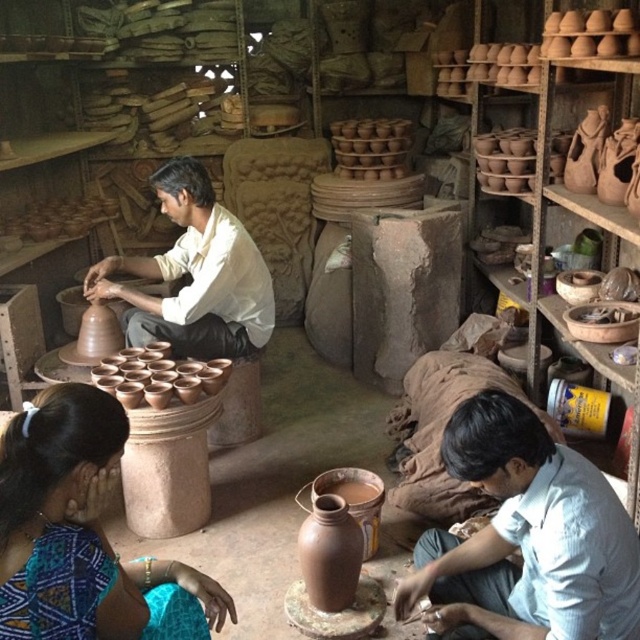
Which is below, blue printed fabric at lower left or matte clay vase at center?

Positioned lower is matte clay vase at center.

Can you confirm if blue printed fabric at lower left is shorter than matte clay vase at center?

No.

Which is in front, point (109, 576) or point (352, 595)?

Point (109, 576) is more forward.

Where is `blue printed fabric at lower left`? This screenshot has height=640, width=640. blue printed fabric at lower left is located at coordinates (76, 529).

Is light blue cotton shirt at lower right to the left of matte clay potter at center from the viewer's perspective?

No, light blue cotton shirt at lower right is not to the left of matte clay potter at center.

Is light blue cotton shirt at lower right smaller than matte clay potter at center?

Correct, light blue cotton shirt at lower right occupies less space than matte clay potter at center.

The width and height of the screenshot is (640, 640). What are the coordinates of `light blue cotton shirt at lower right` in the screenshot? It's located at (525, 538).

Between light blue cotton shirt at lower right and matte clay cups at center, which one has more height?

Standing taller between the two is light blue cotton shirt at lower right.

Describe the element at coordinates (525, 538) in the screenshot. I see `light blue cotton shirt at lower right` at that location.

The width and height of the screenshot is (640, 640). What are the coordinates of `light blue cotton shirt at lower right` in the screenshot? It's located at (525, 538).